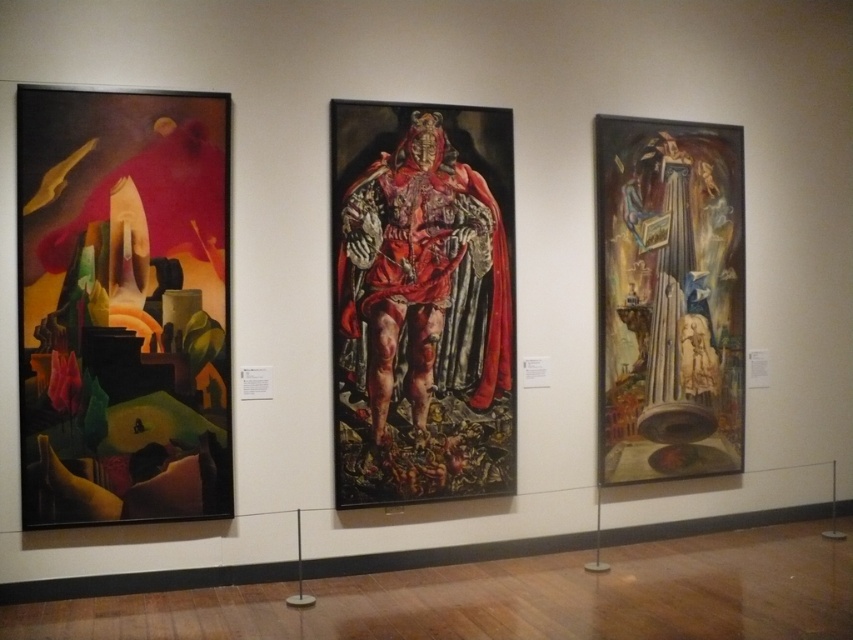
Who is positioned more to the left, abstract painting at left or red velvet cape at center?

abstract painting at left

Does abstract painting at left lie in front of red velvet cape at center?

That is True.

Locate an element on the screen. abstract painting at left is located at coordinates (123, 305).

This screenshot has width=853, height=640. I want to click on abstract painting at left, so click(123, 305).

Based on the photo, is oily canvas column at right above red velvet cape at center?

Actually, oily canvas column at right is below red velvet cape at center.

I want to click on oily canvas column at right, so click(669, 298).

You are a GUI agent. You are given a task and a screenshot of the screen. Output one action in this format:
    pyautogui.click(x=<x>, y=<y>)
    Task: Click on the oily canvas column at right
    The width and height of the screenshot is (853, 640).
    Given the screenshot: What is the action you would take?
    pyautogui.click(x=669, y=298)

Does abstract painting at left have a lesser width compared to oily canvas column at right?

Correct, abstract painting at left's width is less than oily canvas column at right's.

Which is behind, point (218, 184) or point (695, 468)?

The point (695, 468) is behind.

In order to click on abstract painting at left in this screenshot , I will do [x=123, y=305].

The image size is (853, 640). What are the coordinates of `abstract painting at left` in the screenshot? It's located at (123, 305).